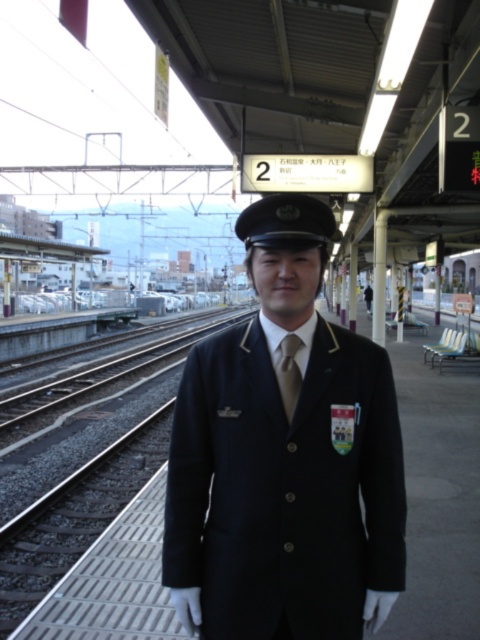
Question: Which point is closer to the camera?

Choices:
 (A) white glossy train at center
 (B) brown satin tie at center

Answer: (B)

Question: Which point is farther to the camera?

Choices:
 (A) white glossy train at center
 (B) navy blue uniform at center
 (C) brown satin tie at center

Answer: (A)

Question: Among these points, which one is nearest to the camera?

Choices:
 (A) (286, 385)
 (B) (210, 605)

Answer: (A)

Question: Is white glossy train at center closer to the viewer compared to brown satin tie at center?

Choices:
 (A) no
 (B) yes

Answer: (A)

Question: Does navy blue uniform at center have a lesser width compared to brown satin tie at center?

Choices:
 (A) no
 (B) yes

Answer: (A)

Question: Can you confirm if navy blue uniform at center is positioned to the right of brown satin tie at center?

Choices:
 (A) yes
 (B) no

Answer: (B)